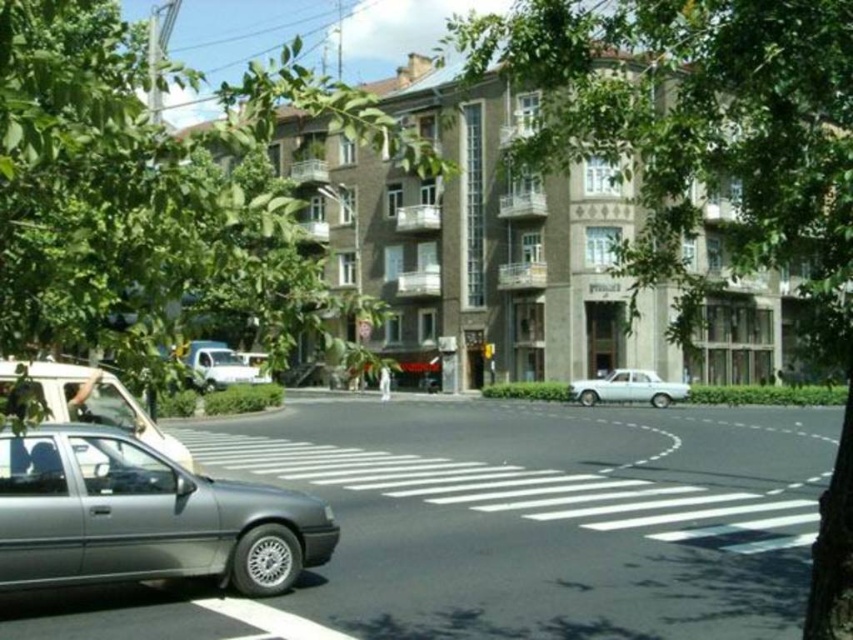
You are a pedestrian standing at the crosswalk and want to cross the street. There is a metallic gray sedan at lower left and a white matte van at center. Which vehicle is closer to your left side?

The metallic gray sedan at lower left is to the right of the white matte van at center, so the white matte van at center is closer to your left side.

Looking at this image, you are a pedestrian standing at the crosswalk. You see the green leafy tree at upper left and the silver metallic car at left. Which object is higher from the ground?

The green leafy tree at upper left is positioned over the silver metallic car at left, so it is higher from the ground.

Based on the photo, you are a pedestrian standing on the sidewalk and want to cross the street to reach the multi story building with beige facade. You see the green leafy tree at upper left and the silver metallic car at left. Which object is closer to you as you stand on the sidewalk?

The green leafy tree at upper left is closer to you because it is in front of the silver metallic car at left, indicating it is nearer in the scene.